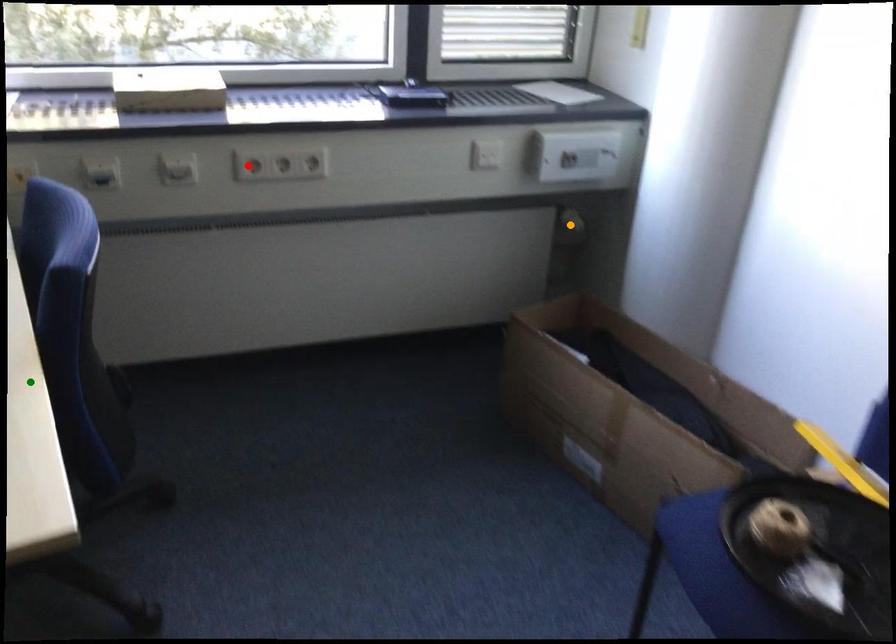
Based on the photo, order these from nearest to farthest:
green point
orange point
red point

orange point, red point, green point